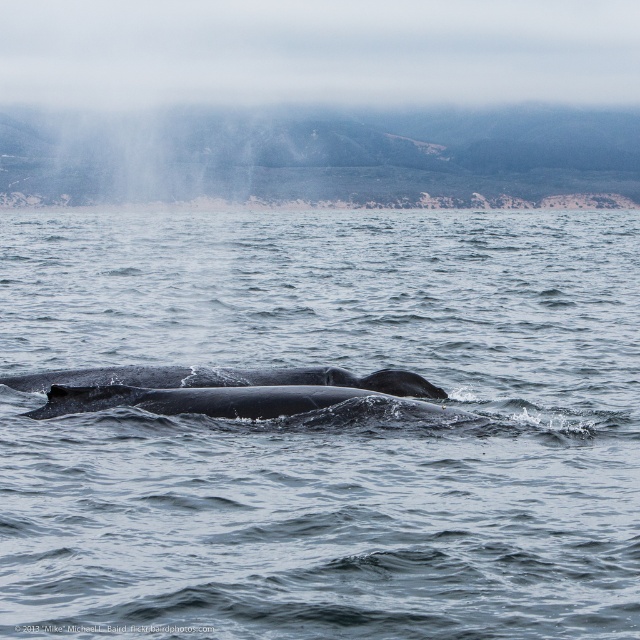
You are a marine biologist studying the marine life in the image. You notice a point marked at coordinates (326,426). Based on the scene description, what does this point most likely represent?

The point at coordinates (326,426) marks gray matte water at center.

You are a marine biologist observing the marine scene. You need to determine if the gray matte water at center can accommodate the gray matte whale at center horizontally. Can you confirm this?

The gray matte water at center is wider than the gray matte whale at center, so yes, the gray matte whale at center can fit horizontally within the gray matte water at center.

You are a marine biologist observing two gray matte objects at the center of a marine scene. You need to determine which one is taller. The scene includes a gray matte water at center and a gray matte whale at center. Which object is taller?

The gray matte water at center is much taller than the gray matte whale at center.